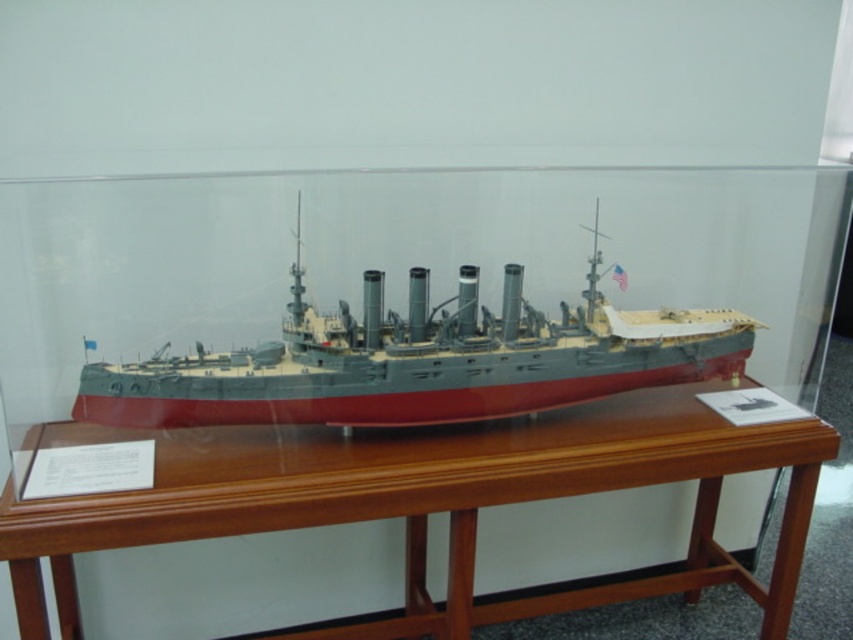
Question: Considering the relative positions of brown polished wood table at center and gray metallic ship at center in the image provided, where is brown polished wood table at center located with respect to gray metallic ship at center?

Choices:
 (A) above
 (B) below

Answer: (B)

Question: Is brown polished wood table at center thinner than gray metallic ship at center?

Choices:
 (A) yes
 (B) no

Answer: (B)

Question: Can you confirm if brown polished wood table at center is positioned to the right of gray metallic ship at center?

Choices:
 (A) yes
 (B) no

Answer: (B)

Question: Which object appears farthest from the camera in this image?

Choices:
 (A) gray metallic ship at center
 (B) brown polished wood table at center

Answer: (A)

Question: Among these points, which one is farthest from the camera?

Choices:
 (A) (61, 438)
 (B) (289, 333)

Answer: (A)